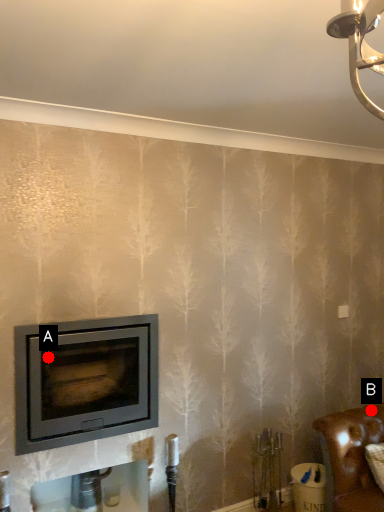
Question: Two points are circled on the image, labeled by A and B beside each circle. Which point is farther to the camera?

Choices:
 (A) A is further
 (B) B is further

Answer: (B)